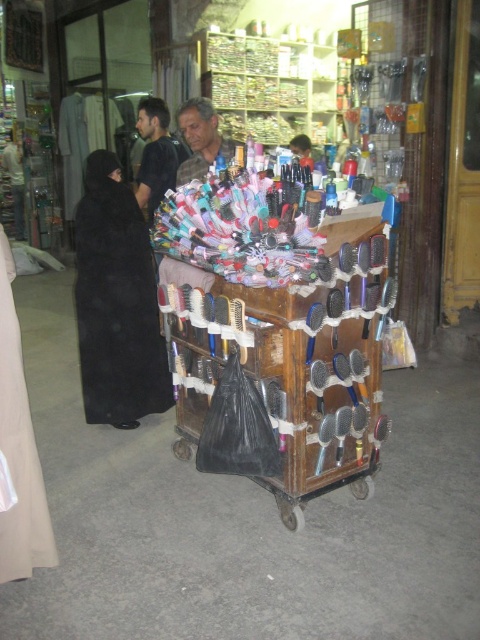
Question: Which of the following is the closest to the observer?

Choices:
 (A) (165, 108)
 (B) (147, 385)
 (C) (242, 147)

Answer: (C)

Question: From the image, what is the correct spatial relationship of black matte abaya at left in relation to dark brown hair at center?

Choices:
 (A) left
 (B) right

Answer: (A)

Question: Which point is farther to the camera?

Choices:
 (A) click(248, 284)
 (B) click(141, 99)

Answer: (B)

Question: Is black matte abaya at left bigger than camouflage fabric shirt at center?

Choices:
 (A) no
 (B) yes

Answer: (B)

Question: Which is farther from the black matte abaya at left?

Choices:
 (A) camouflage fabric shirt at center
 (B) wooden trolley at center
 (C) dark brown hair at center

Answer: (B)

Question: Can you confirm if wooden trolley at center is smaller than black matte abaya at left?

Choices:
 (A) no
 (B) yes

Answer: (A)